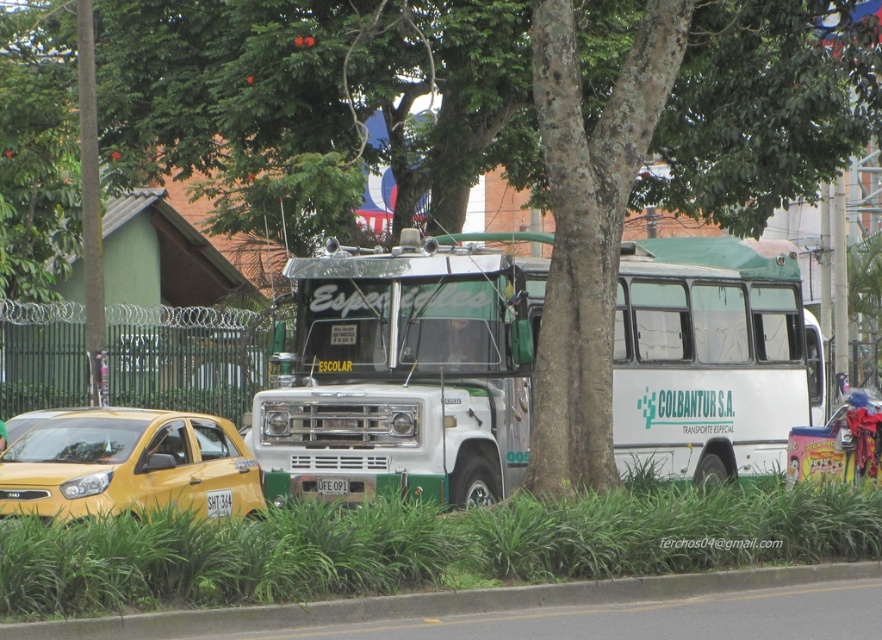
Question: Which point is farther to the camera?

Choices:
 (A) gray concrete curb at lower center
 (B) white matte license plate at center
 (C) yellow matte taxi at lower left
 (D) white/green matte bus at center

Answer: (D)

Question: Which object is closer to the camera taking this photo?

Choices:
 (A) white matte license plate at center
 (B) white/green matte bus at center
 (C) yellow matte taxi at lower left

Answer: (C)

Question: Is gray concrete curb at lower center positioned in front of white matte license plate at center?

Choices:
 (A) no
 (B) yes

Answer: (B)

Question: Among these points, which one is farthest from the camera?

Choices:
 (A) (226, 611)
 (B) (50, 454)

Answer: (B)

Question: Does yellow matte taxi at lower left have a lesser width compared to gray concrete curb at lower center?

Choices:
 (A) yes
 (B) no

Answer: (B)

Question: Is white/green matte bus at center smaller than gray concrete curb at lower center?

Choices:
 (A) yes
 (B) no

Answer: (B)